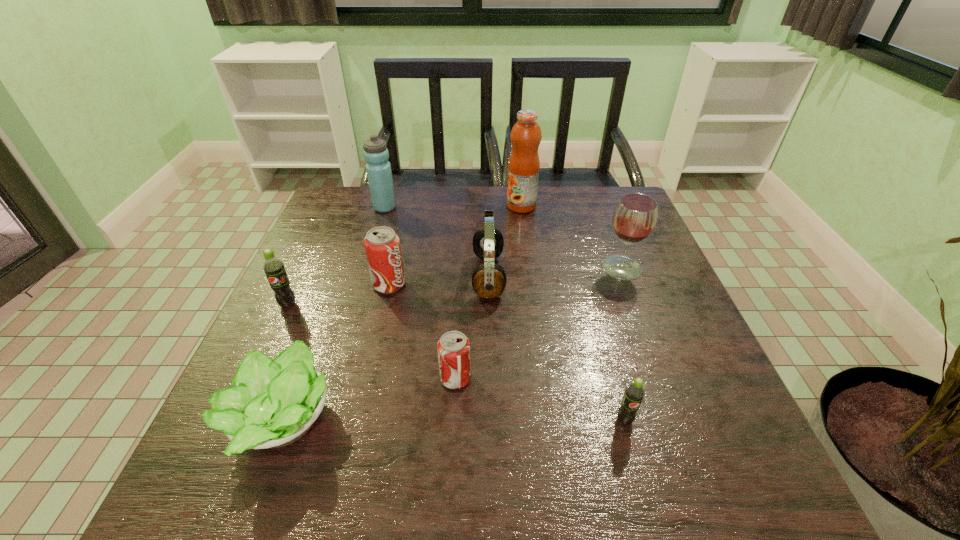
Image resolution: width=960 pixels, height=540 pixels. Identify the location of vacant space at the right edge. (673, 387).

You are a GUI agent. You are given a task and a screenshot of the screen. Output one action in this format:
    pyautogui.click(x=<x>, y=<y>)
    Task: Click on the vacant region at the far left corner of the desktop
    
    Given the screenshot: What is the action you would take?
    pyautogui.click(x=362, y=217)

Identify the location of blank space at the near left corner of the desktop. Image resolution: width=960 pixels, height=540 pixels. (286, 456).

In the image, there is a desktop. Identify the location of vacant space at the far right corner. (601, 193).

The width and height of the screenshot is (960, 540). I want to click on vacant region at the near right corner, so click(x=727, y=487).

At what (x,y) coordinates should I click in order to perform the action: click on vacant space in between the lettuce and the headset. Please return your answer as a coordinate pair (x, y). Looking at the image, I should click on (385, 349).

Identify the location of free space that is in between the smaller green soda and the tallest object. (573, 313).

Where is `free space between the leftmost soda and the smaller pink soda can`? free space between the leftmost soda and the smaller pink soda can is located at coordinates (372, 342).

Find the location of a particular element. Image resolution: width=960 pixels, height=540 pixels. free space between the headset and the bigger pink soda can is located at coordinates (439, 280).

Where is `vacant point located between the orange fruit juice and the headset`? The width and height of the screenshot is (960, 540). vacant point located between the orange fruit juice and the headset is located at coordinates (505, 241).